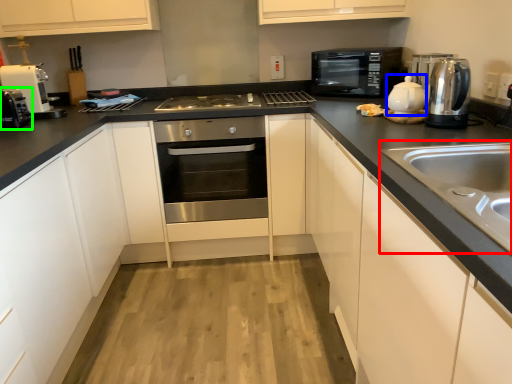
Question: Which object is positioned farthest from sink (highlighted by a red box)? Select from tea pot (highlighted by a blue box) and toaster (highlighted by a green box).

Choices:
 (A) tea pot
 (B) toaster

Answer: (B)